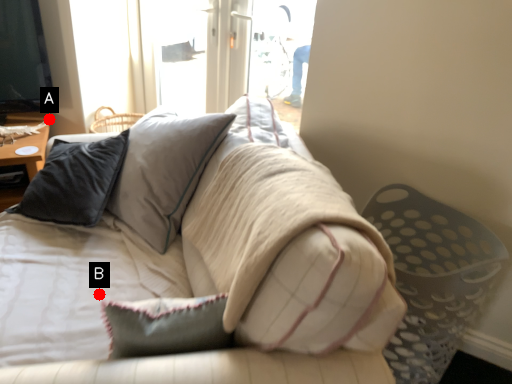
Question: Two points are circled on the image, labeled by A and B beside each circle. Which point is closer to the camera?

Choices:
 (A) A is closer
 (B) B is closer

Answer: (B)